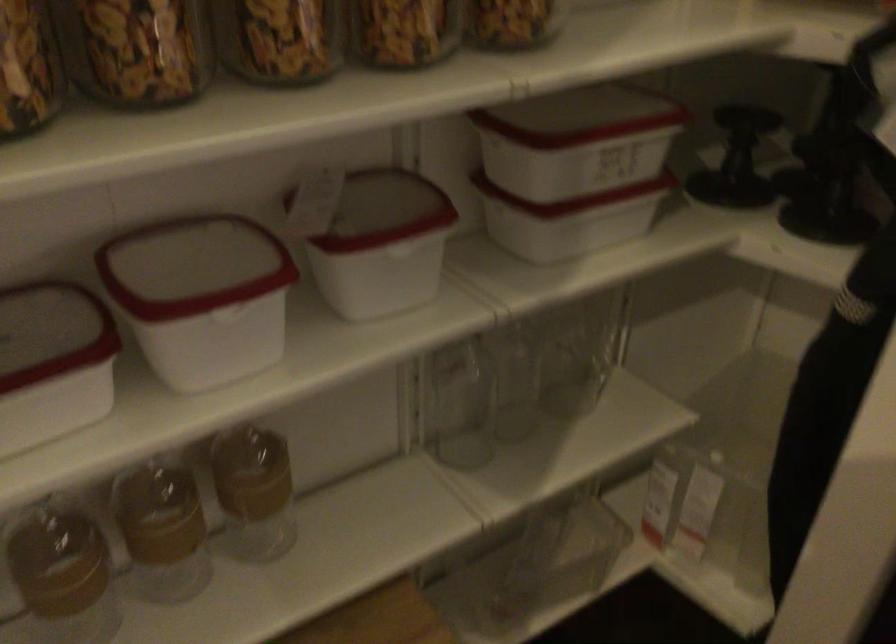
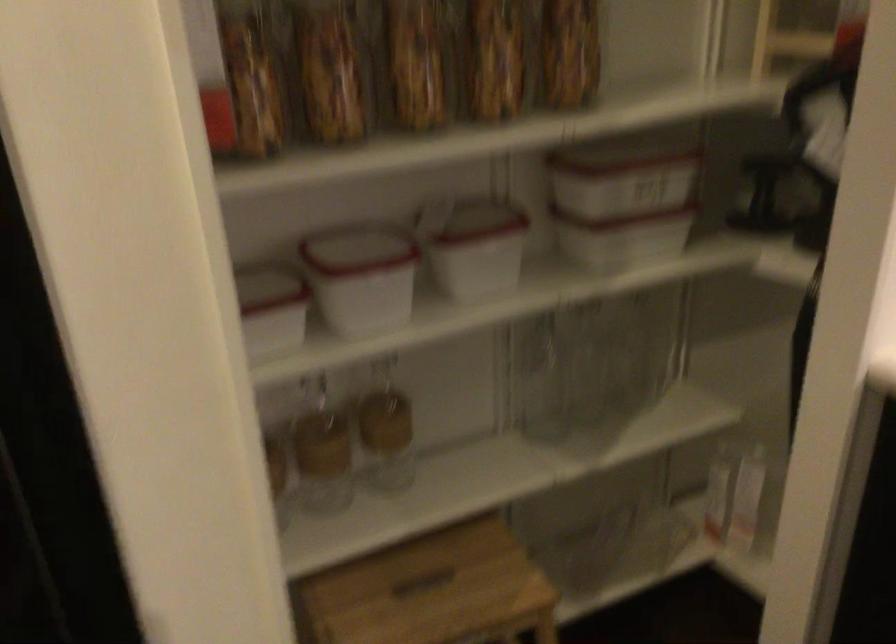
The point at (162, 532) is marked in the first image. Where is the corresponding point in the second image?

(322, 451)